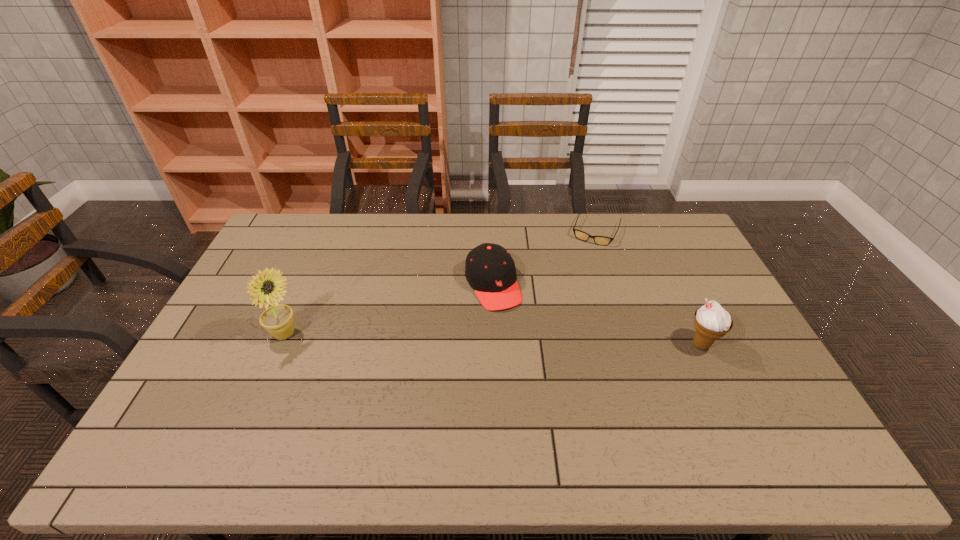
This screenshot has height=540, width=960. What are the coordinates of `the leftmost object` in the screenshot? It's located at (267, 288).

Find the location of `the tallest object`. the tallest object is located at coordinates (267, 288).

Where is `the third shortest object`? the third shortest object is located at coordinates (711, 321).

The width and height of the screenshot is (960, 540). I want to click on the rightmost object, so click(x=711, y=321).

Identify the location of the third tallest object. (490, 270).

You are a GUI agent. You are given a task and a screenshot of the screen. Output one action in this format:
    pyautogui.click(x=<x>, y=<y>)
    Task: Click on the third nearest object
    This screenshot has width=960, height=540.
    Given the screenshot: What is the action you would take?
    pyautogui.click(x=490, y=270)

Locate an element on the screen. The width and height of the screenshot is (960, 540). the second object from right to left is located at coordinates (583, 236).

You are a GUI agent. You are given a task and a screenshot of the screen. Output one action in this format:
    pyautogui.click(x=<x>, y=<y>)
    Task: Click on the sunglasses
    
    Given the screenshot: What is the action you would take?
    pyautogui.click(x=583, y=236)

Where is `free region located on the face of the leftmost object`? This screenshot has height=540, width=960. free region located on the face of the leftmost object is located at coordinates (324, 335).

Where is `free space located 0.060m on the front of the icecream`? free space located 0.060m on the front of the icecream is located at coordinates (716, 376).